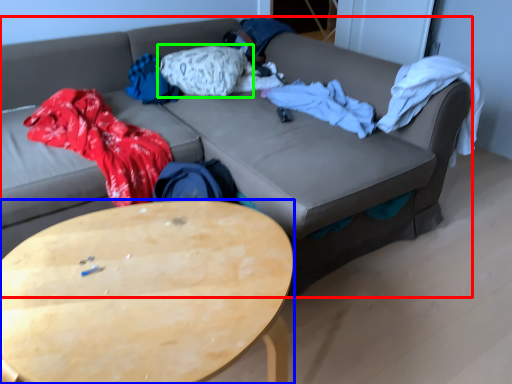
Question: Based on their relative distances, which object is nearer to studio couch (highlighted by a red box)? Choose from coffee table (highlighted by a blue box) and pillow (highlighted by a green box).

Choices:
 (A) coffee table
 (B) pillow

Answer: (B)